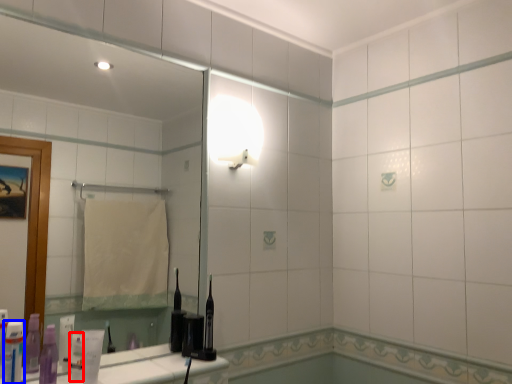
Question: Which point is further to the camera, toiletry (highlighted by a red box) or toiletry (highlighted by a blue box)?

Choices:
 (A) toiletry
 (B) toiletry

Answer: (A)